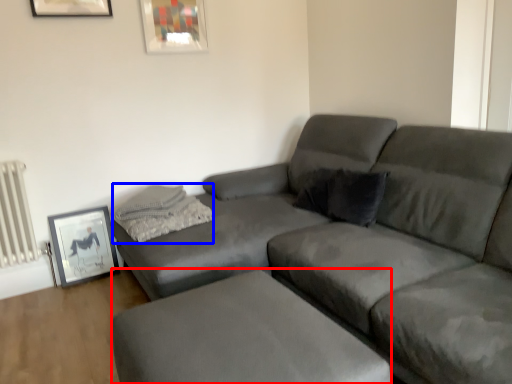
Question: Which point is further to the camera, footrest (highlighted by a red box) or pillow (highlighted by a blue box)?

Choices:
 (A) footrest
 (B) pillow

Answer: (B)